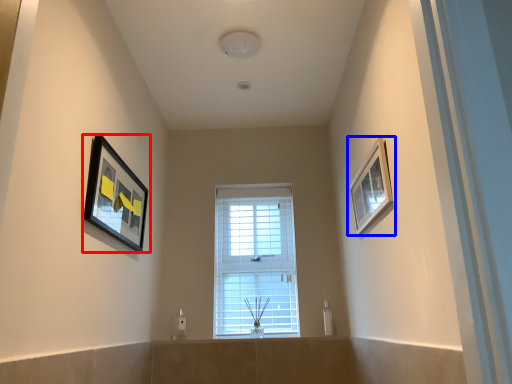
Question: Among these objects, which one is nearest to the camera, picture frame (highlighted by a red box) or picture frame (highlighted by a blue box)?

Choices:
 (A) picture frame
 (B) picture frame

Answer: (B)